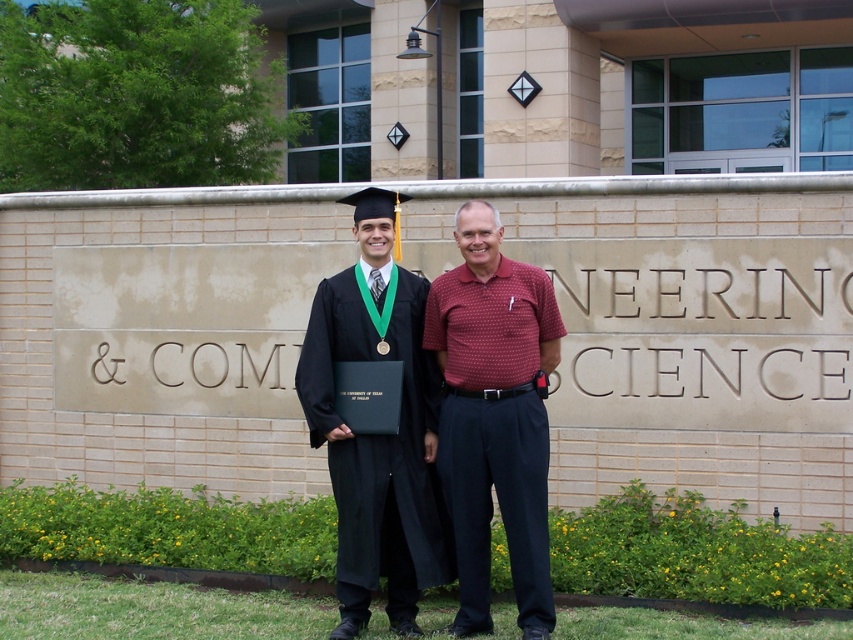
Question: Among these points, which one is farthest from the camera?

Choices:
 (A) (338, 292)
 (B) (303, 365)

Answer: (B)

Question: Can you confirm if matte black graduation gown at center is thinner than black matte gown at center?

Choices:
 (A) yes
 (B) no

Answer: (A)

Question: Is matte black graduation gown at center below black matte gown at center?

Choices:
 (A) yes
 (B) no

Answer: (B)

Question: Which of the following is the farthest from the observer?

Choices:
 (A) black matte gown at center
 (B) matte black graduation gown at center

Answer: (A)

Question: Is matte black graduation gown at center above black matte gown at center?

Choices:
 (A) no
 (B) yes

Answer: (B)